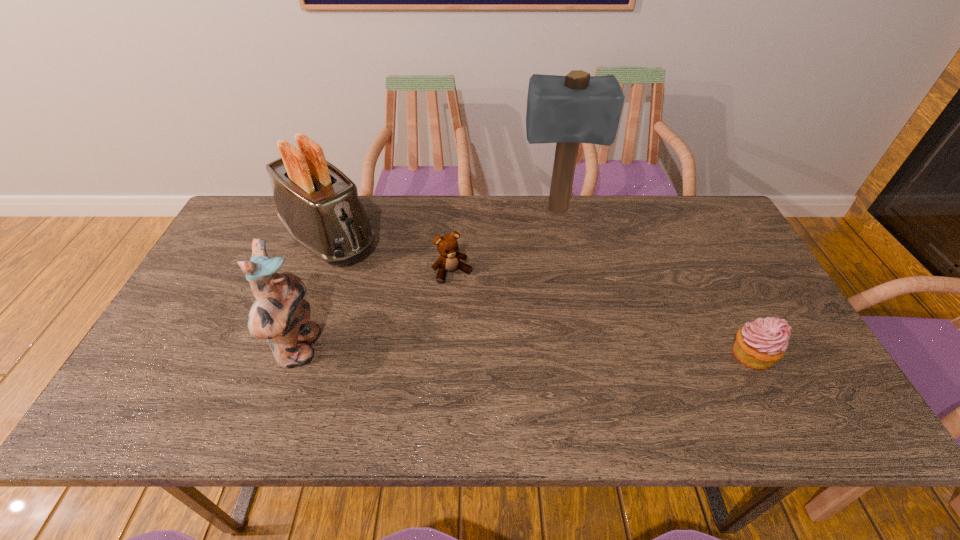
Find the location of a particular element. free space on the desktop that is between the figurine and the rightmost object and is positioned on the front-facing side of the third object from right to left is located at coordinates (501, 352).

The image size is (960, 540). In order to click on free space on the desktop that is between the figurine and the cupcake and is positioned on the side of the toaster with the control lever in this screenshot , I will do `click(459, 351)`.

Identify the location of free space on the desktop that is between the figurine and the rightmost object and is positioned on the striking surface of the mallet. (573, 353).